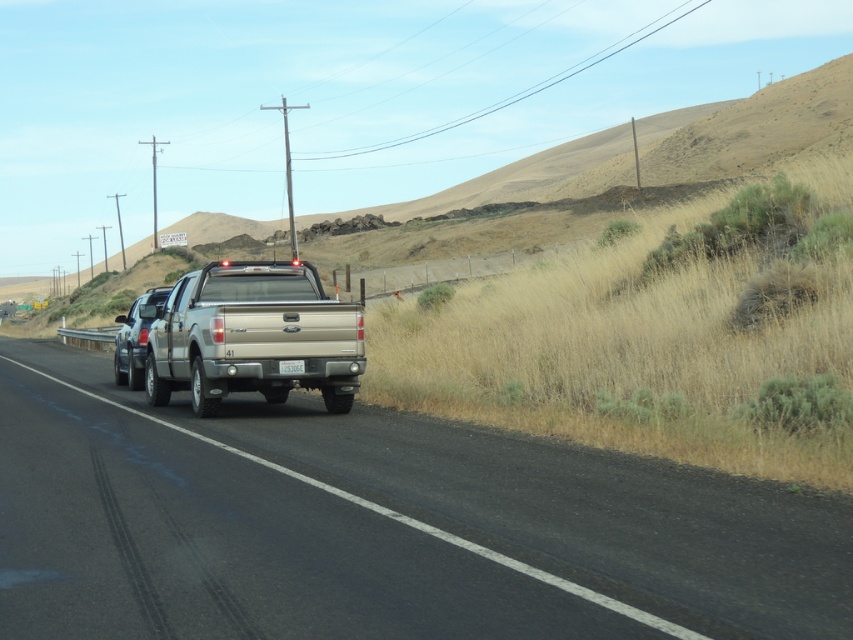
Question: Which of the following is the closest to the observer?

Choices:
 (A) silver metallic truck at center
 (B) satin silver truck at left
 (C) smooth asphalt road at center

Answer: (C)

Question: Which point is closer to the camera?

Choices:
 (A) (128, 368)
 (B) (299, 371)

Answer: (B)

Question: Considering the relative positions of satin silver truck at left and white plastic license plate at rear in the image provided, where is satin silver truck at left located with respect to white plastic license plate at rear?

Choices:
 (A) right
 (B) left

Answer: (B)

Question: From the image, what is the correct spatial relationship of smooth asphalt road at center in relation to silver metallic truck at center?

Choices:
 (A) above
 (B) below

Answer: (B)

Question: Estimate the real-world distances between objects in this image. Which object is closer to the white plastic license plate at rear?

Choices:
 (A) silver metallic truck at center
 (B) satin silver truck at left

Answer: (A)

Question: Does silver metallic truck at center appear on the left side of satin silver truck at left?

Choices:
 (A) yes
 (B) no

Answer: (B)